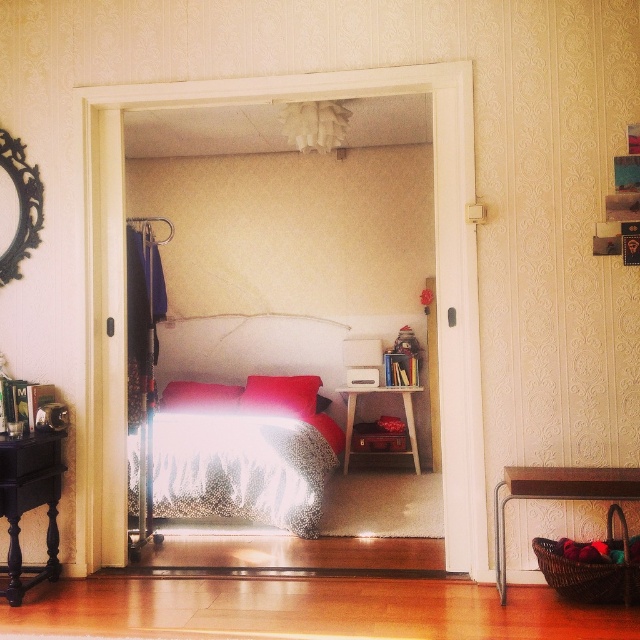
What do you see at coordinates (243, 426) in the screenshot? The image size is (640, 640). I see `patterned fabric bed at center` at bounding box center [243, 426].

Which is in front, point (317, 412) or point (612, 468)?

Point (612, 468) is more forward.

Identify the location of patterned fabric bed at center. (243, 426).

The height and width of the screenshot is (640, 640). I want to click on woven wicker basket at lower right, so click(570, 499).

Does woven wicker basket at lower right come behind velvet red pillow at center?

No, it is not.

Which is behind, point (509, 477) or point (269, 403)?

Point (269, 403)

In order to click on woven wicker basket at lower right in this screenshot , I will do point(570,499).

Does woven wicker basket at lower right come in front of red velvet pillow at center?

Yes, woven wicker basket at lower right is closer to the viewer.

Is point (572, 476) less distant than point (168, 401)?

Yes, point (572, 476) is closer to viewer.

The image size is (640, 640). Find the location of `woven wicker basket at lower right`. woven wicker basket at lower right is located at coordinates (570, 499).